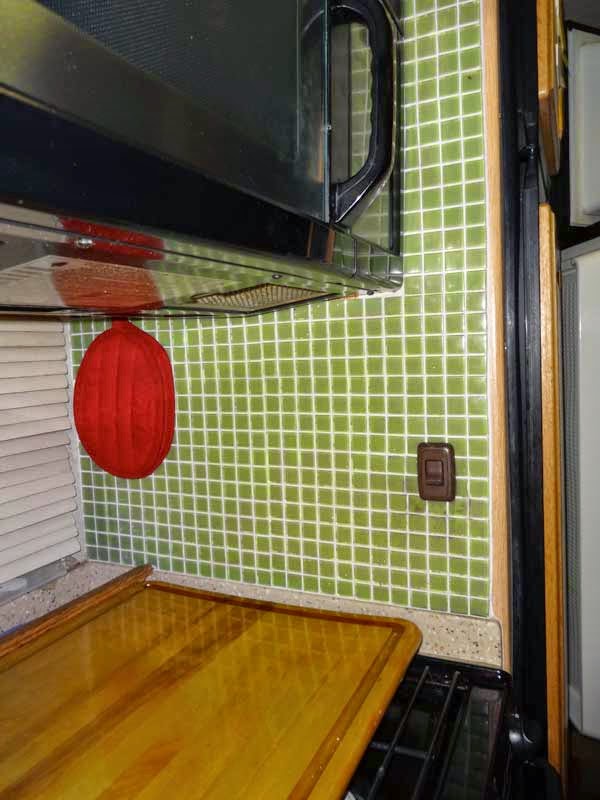
Locate an element on the screen. The height and width of the screenshot is (800, 600). grate over stove is located at coordinates (391, 750).